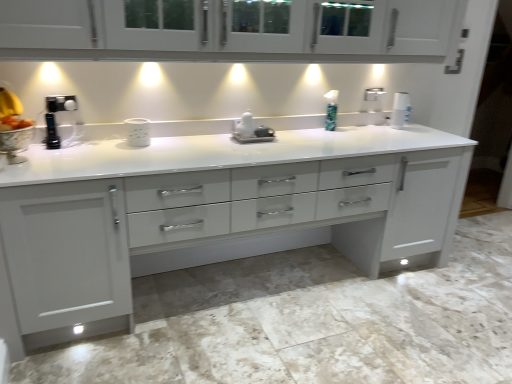
Question: Considering the relative sizes of white glossy paper towel at upper right and white glossy countertop at center in the image provided, is white glossy paper towel at upper right wider than white glossy countertop at center?

Choices:
 (A) no
 (B) yes

Answer: (A)

Question: Does white glossy paper towel at upper right appear on the left side of white glossy countertop at center?

Choices:
 (A) no
 (B) yes

Answer: (A)

Question: Is white glossy paper towel at upper right facing away from white glossy countertop at center?

Choices:
 (A) yes
 (B) no

Answer: (B)

Question: From a real-world perspective, is white glossy paper towel at upper right physically below white glossy countertop at center?

Choices:
 (A) yes
 (B) no

Answer: (B)

Question: From the image's perspective, is white glossy paper towel at upper right beneath white glossy countertop at center?

Choices:
 (A) yes
 (B) no

Answer: (B)

Question: Is white glossy paper towel at upper right behind white glossy countertop at center?

Choices:
 (A) yes
 (B) no

Answer: (A)

Question: From the image's perspective, would you say white glossy cabinet at upper center is shown under white glossy countertop at center?

Choices:
 (A) no
 (B) yes

Answer: (A)

Question: Considering the relative sizes of white glossy cabinet at upper center and white glossy countertop at center in the image provided, is white glossy cabinet at upper center shorter than white glossy countertop at center?

Choices:
 (A) yes
 (B) no

Answer: (A)

Question: Is white glossy cabinet at upper center bigger than white glossy countertop at center?

Choices:
 (A) no
 (B) yes

Answer: (A)

Question: From a real-world perspective, does white glossy cabinet at upper center sit lower than white glossy countertop at center?

Choices:
 (A) yes
 (B) no

Answer: (B)

Question: From a real-world perspective, is white glossy cabinet at upper center on top of white glossy countertop at center?

Choices:
 (A) yes
 (B) no

Answer: (A)

Question: Can you confirm if white glossy cabinet at upper center is smaller than white glossy countertop at center?

Choices:
 (A) no
 (B) yes

Answer: (B)

Question: Does white glossy cabinet at upper center have a lesser height compared to green plastic soap dispenser at center?

Choices:
 (A) no
 (B) yes

Answer: (A)